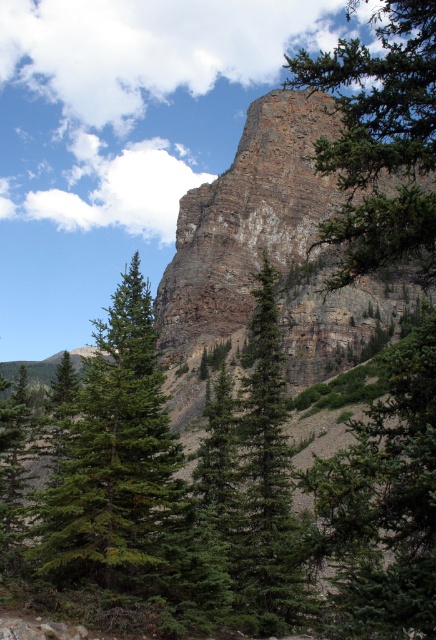
Question: Which point is closer to the camera taking this photo?

Choices:
 (A) (177, 464)
 (B) (418, 193)
 (C) (251, 404)

Answer: (B)

Question: Can you confirm if rusty brown rock at upper center is positioned to the right of green textured pine tree at center?

Choices:
 (A) no
 (B) yes

Answer: (A)

Question: Is the position of green needle-like tree at center more distant than that of green textured pine tree at upper right?

Choices:
 (A) yes
 (B) no

Answer: (A)

Question: Which point is farther from the camera taking this photo?

Choices:
 (A) (265, 449)
 (B) (350, 147)

Answer: (A)

Question: Estimate the real-world distances between objects in this image. Which object is closer to the green textured pine tree at upper right?

Choices:
 (A) green needle-like tree at center
 (B) rusty brown rock at upper center

Answer: (B)

Question: Is green needle-like tree at center above green textured pine tree at center?

Choices:
 (A) yes
 (B) no

Answer: (B)